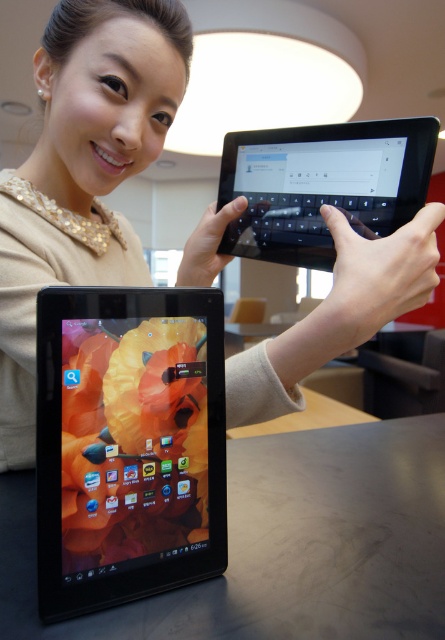
You are an interior designer arranging items on a table. You need to place a matte black tablet at lower left and a matte black tablet at center so that they are positioned correctly according to the scene. Which tablet should be placed to the right of the other?

The matte black tablet at lower left should be placed to the right of the matte black tablet at center.

You are setting up a presentation and need to place a tablet on the black matte table at lower center. Based on the scene description, where exactly is the black matte table positioned in the image?

The black matte table at lower center is located at point coordinates of 0.852 on the x axis and 0.638 on the y axis.

You are setting up for a presentation and need to place both the black matte table at lower center and the black glossy tablet at center on a stage. If the stage has limited space, which object should you prioritize placing first to ensure it fits?

The black matte table at lower center is bigger than the black glossy tablet at center, so you should prioritize placing the black matte table at lower center first to ensure it fits within the limited space.